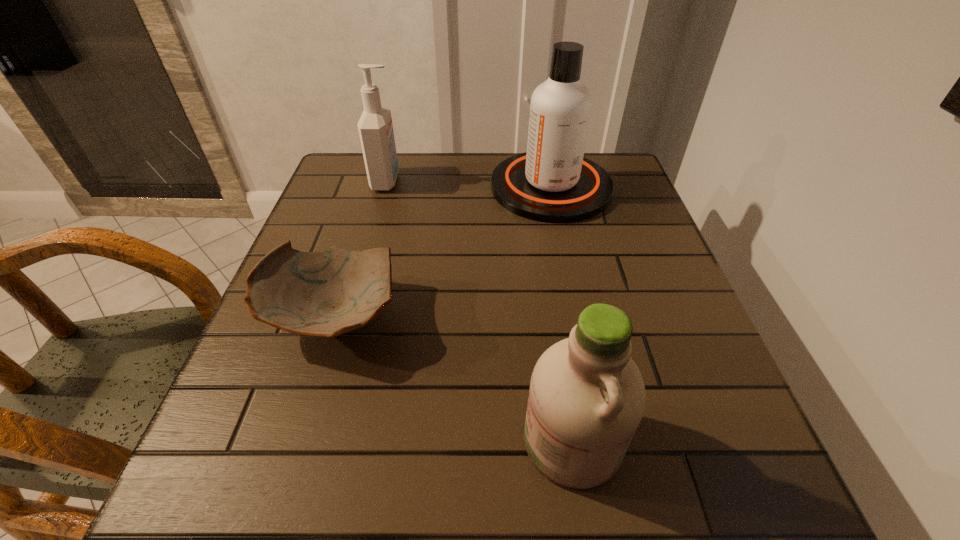
Image resolution: width=960 pixels, height=540 pixels. Identify the location of free space that is in between the third farthest object and the nearest object. (452, 379).

Locate an element on the screen. This screenshot has height=540, width=960. free point between the leftmost cleansing agent and the second nearest object is located at coordinates (360, 249).

Find the location of a particular element. vacant space that's between the leftmost cleansing agent and the nearest object is located at coordinates (479, 310).

Locate an element on the screen. The height and width of the screenshot is (540, 960). empty space that is in between the shortest object and the leftmost cleansing agent is located at coordinates (360, 249).

Where is `empty space that is in between the second nearest object and the nearest object`? The width and height of the screenshot is (960, 540). empty space that is in between the second nearest object and the nearest object is located at coordinates (452, 379).

Identify the location of vacant region between the leftmost cleansing agent and the nearest object. (479, 310).

Locate an element on the screen. This screenshot has width=960, height=540. free spot between the nearest cleansing agent and the leftmost cleansing agent is located at coordinates (479, 310).

In order to click on empty space between the shortest object and the nearest cleansing agent in this screenshot , I will do [452, 379].

Locate an element on the screen. The image size is (960, 540). the second closest object to the third farthest object is located at coordinates (552, 182).

Identify the location of the closest object to the pottery. This screenshot has height=540, width=960. (587, 397).